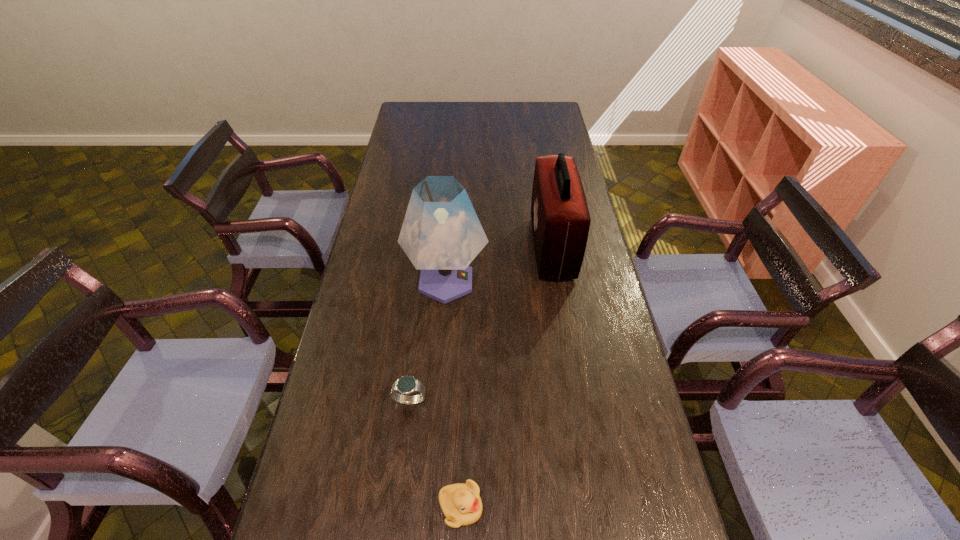
Where is `unoccupied area between the nearest object and the lampshade`? This screenshot has width=960, height=540. unoccupied area between the nearest object and the lampshade is located at coordinates (453, 394).

Locate an element on the screen. empty space that is in between the lampshade and the third farthest object is located at coordinates (428, 341).

What are the coordinates of `empty space between the first aid kit and the lampshade` in the screenshot? It's located at (499, 264).

Locate an element on the screen. This screenshot has width=960, height=540. vacant space in between the duckling and the lampshade is located at coordinates (453, 394).

Find the location of a particular element. This screenshot has width=960, height=540. vacant area between the duckling and the rightmost object is located at coordinates (506, 377).

Identify which object is located as the nearest to the third farthest object. Please provide its 2D coordinates. Your answer should be formatted as a tuple, i.e. [(x, y)], where the tuple contains the x and y coordinates of a point satisfying the conditions above.

[(461, 504)]

Identify which object is the nearest to the lampshade. Please provide its 2D coordinates. Your answer should be formatted as a tuple, i.e. [(x, y)], where the tuple contains the x and y coordinates of a point satisfying the conditions above.

[(560, 218)]